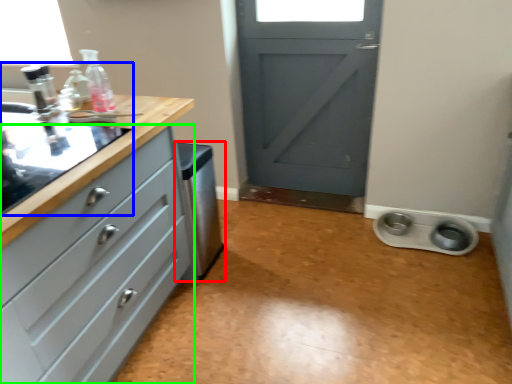
Question: Estimate the real-world distances between objects in this image. Which object is closer to dish washer (highlighted by a red box), sink (highlighted by a blue box) or chest of drawers (highlighted by a green box)?

Choices:
 (A) sink
 (B) chest of drawers

Answer: (B)